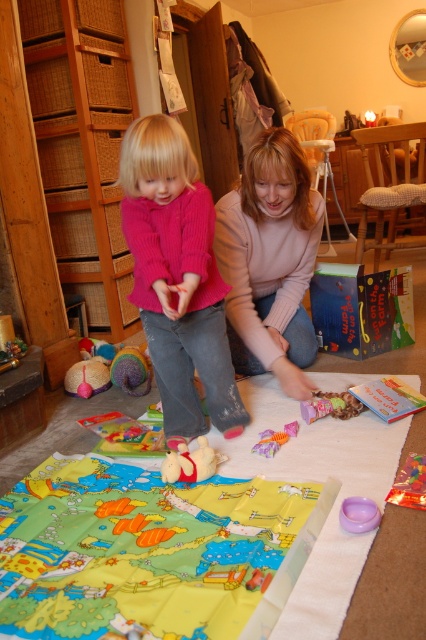
Question: Which point is closer to the camera?

Choices:
 (A) (314, 396)
 (B) (172, 461)
 (C) (147, 365)
 (D) (207, 392)

Answer: (B)

Question: Can you confirm if multicolored rubber toy at center is smaller than fluffy pink teddy bear at lower left?

Choices:
 (A) no
 (B) yes

Answer: (A)

Question: Which object is farther from the camera taking this photo?

Choices:
 (A) purple plastic bowl at lower center
 (B) fluffy plush toy at center

Answer: (B)

Question: Does fluffy pink teddy bear at lower left appear over plush orange and purple toy at center?

Choices:
 (A) yes
 (B) no

Answer: (A)

Question: Considering the relative positions of fluffy plush toy at center and purple plastic bowl at lower center in the image provided, where is fluffy plush toy at center located with respect to purple plastic bowl at lower center?

Choices:
 (A) above
 (B) below

Answer: (A)

Question: Which is farther from the multicolored rubber toy at center?

Choices:
 (A) knitted pink sweater at center
 (B) fluffy plush toy at center

Answer: (B)